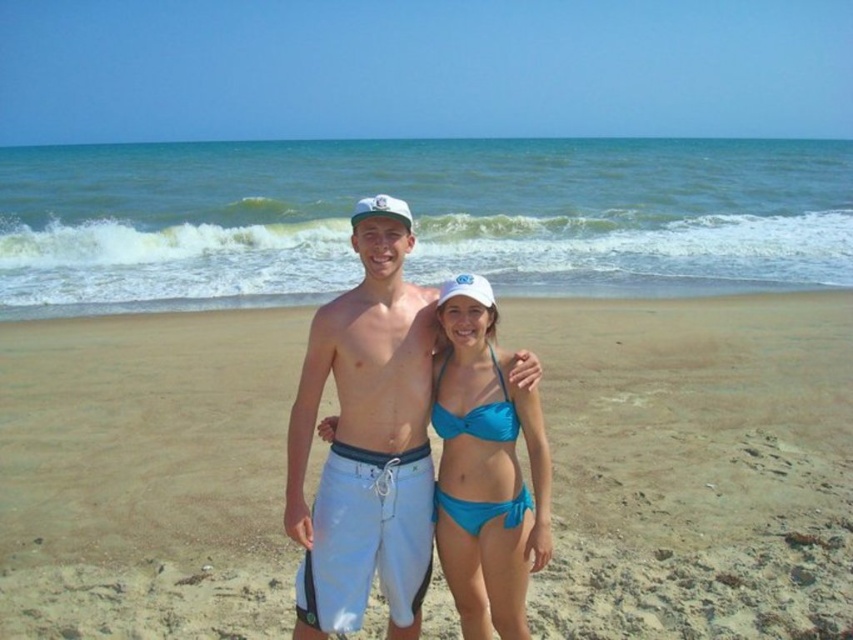
You are a photographer standing at the edge of the beach, and you want to take a photo of the two people in the scene. You notice two points marked in the image. Which point is closer to you, point (467,419) or point (392,208)?

Point (467,419) is further to the viewer than point (392,208), so point (392,208) is closer to you.

You are a photographer trying to capture the two people in the beach scene. You want to ensure that both the smooth sand at center and the white cotton shorts at center are clearly visible in your photo. Given their positions, which object should you focus on first to ensure both are in sharp focus?

You should focus on the smooth sand at center first because the white cotton shorts at center is behind it, so focusing on the closer object ensures both will be in focus.